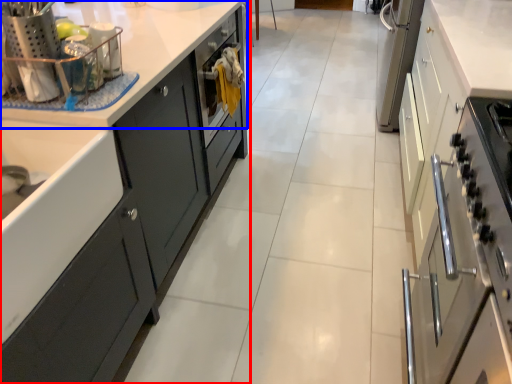
Question: Which object is closer to the camera taking this photo, cabinetry (highlighted by a red box) or countertop (highlighted by a blue box)?

Choices:
 (A) cabinetry
 (B) countertop

Answer: (A)